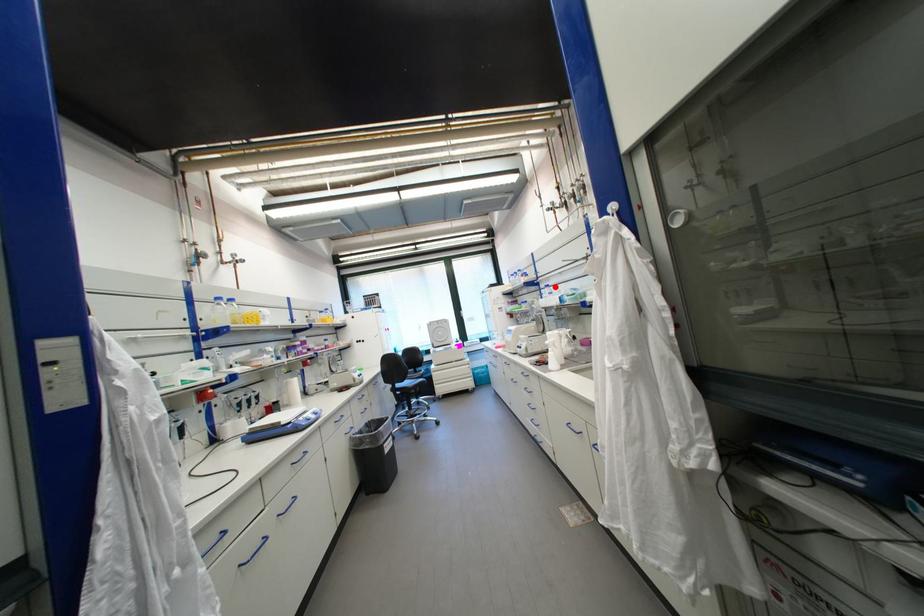
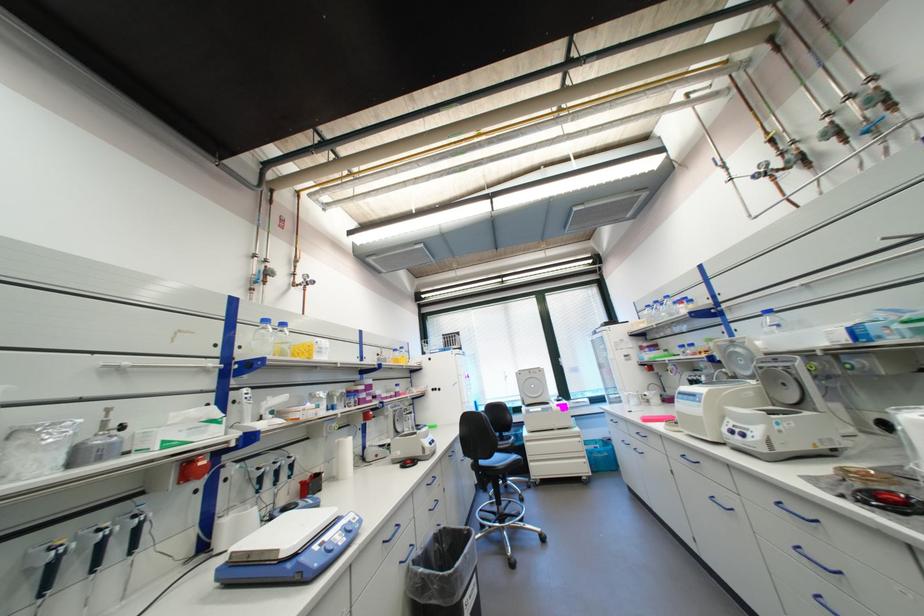
Locate, in the second image, the point that corresponds to the highlighted location in the first image.

(776, 312)